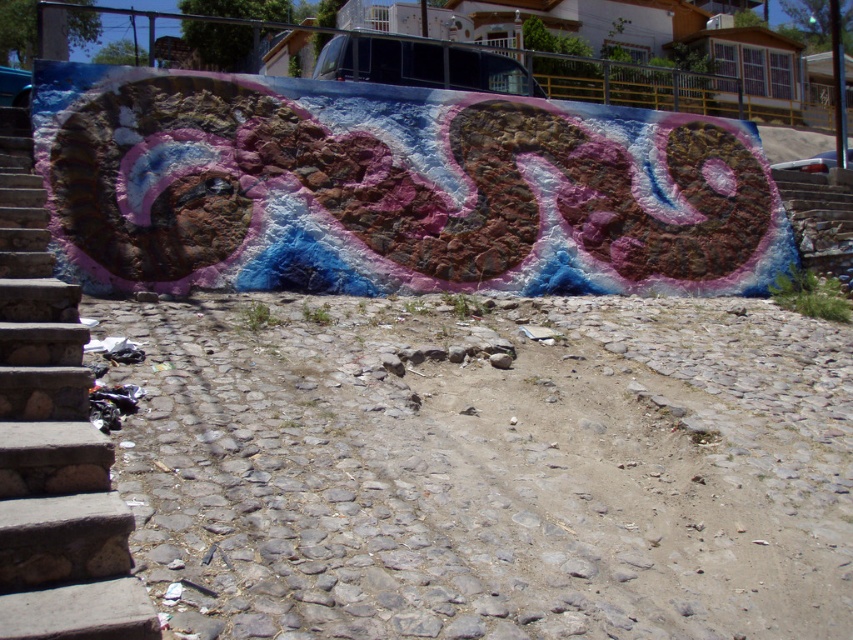
Question: Can you confirm if dirt track at lower center is bigger than stone stairs at left?

Choices:
 (A) yes
 (B) no

Answer: (B)

Question: Among these objects, which one is farthest from the camera?

Choices:
 (A) dirt track at lower center
 (B) stone stairs at left

Answer: (A)

Question: Is dirt track at lower center positioned behind stone stairs at left?

Choices:
 (A) yes
 (B) no

Answer: (A)

Question: Does dirt track at lower center have a lesser width compared to stone stairs at left?

Choices:
 (A) yes
 (B) no

Answer: (A)